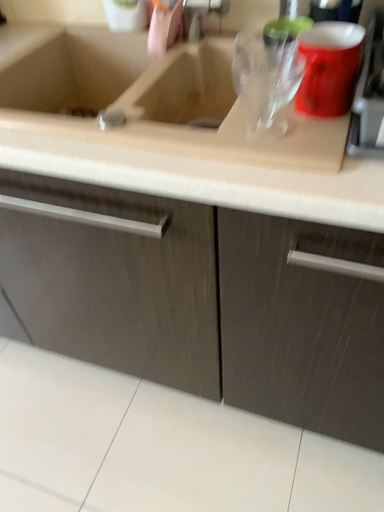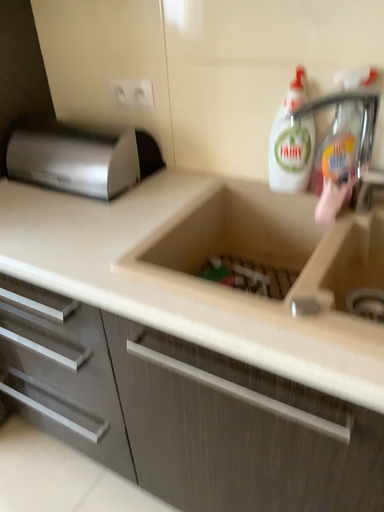
Question: Which way did the camera rotate in the video?

Choices:
 (A) rotated downward
 (B) rotated upward

Answer: (B)